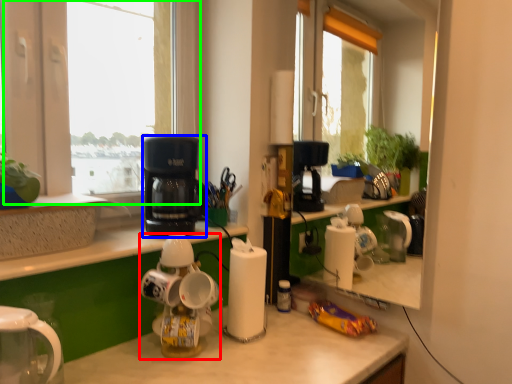
Question: Estimate the real-world distances between objects in this image. Which object is closer to kitchen appliance (highlighted by a red box), kitchen appliance (highlighted by a blue box) or window (highlighted by a green box)?

Choices:
 (A) kitchen appliance
 (B) window

Answer: (A)